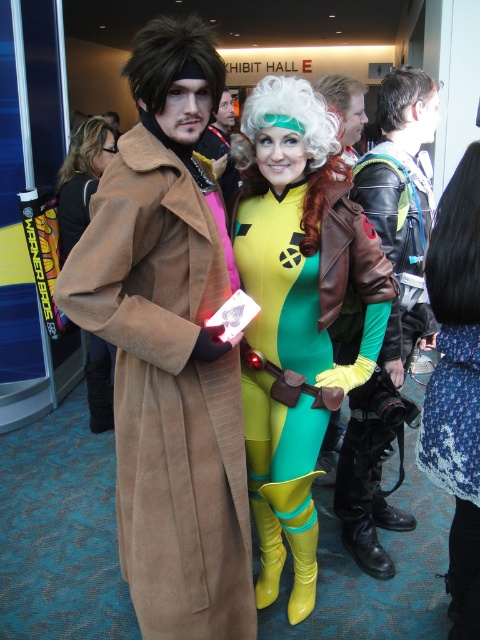
Does suede coat at left appear under leather jacket at center?

Yes.

Can you confirm if suede coat at left is taller than leather jacket at center?

In fact, suede coat at left may be shorter than leather jacket at center.

Between point (127, 465) and point (348, 524), which one is positioned in front?

Positioned in front is point (127, 465).

The width and height of the screenshot is (480, 640). In order to click on suede coat at left in this screenshot , I will do point(168,394).

Who is more forward, (210, 564) or (91, 172)?

Point (210, 564)

Where is `suede coat at left`? suede coat at left is located at coordinates (168, 394).

Which is behind, point (179, 257) or point (86, 163)?

Positioned behind is point (86, 163).

What are the coordinates of `suede coat at left` in the screenshot? It's located at (168, 394).

What do you see at coordinates (403, 93) in the screenshot?
I see `white curly wig at upper right` at bounding box center [403, 93].

In the scene shown: Between white curly wig at upper right and shiny brown leather jacket at center, which one is positioned higher?

Positioned higher is white curly wig at upper right.

I want to click on white curly wig at upper right, so click(x=403, y=93).

Where is `white curly wig at upper right`? The height and width of the screenshot is (640, 480). white curly wig at upper right is located at coordinates (403, 93).